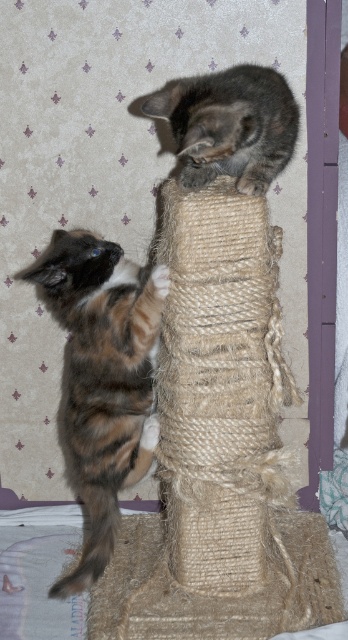
You are a cat owner who wants to place a new toy between the calico fur cat at left and the gray textured cat at upper center. The toy requires 12 inches of space to be placed safely. Can you fit the toy between them?

The calico fur cat at left is 11.94 inches from the gray textured cat at upper center, so the distance is slightly less than the required 12 inches. Therefore, the toy cannot be placed safely between them.

You are a cat owner who wants to ensure your cat can comfortably reach the scratching post. If the calico fur cat at left is 1.16 meters away from you, can it easily access the scratching post?

The calico fur cat at left is 1.16 meters away from the viewer, so it can easily access the scratching post as this distance is within a typical cat reach range.